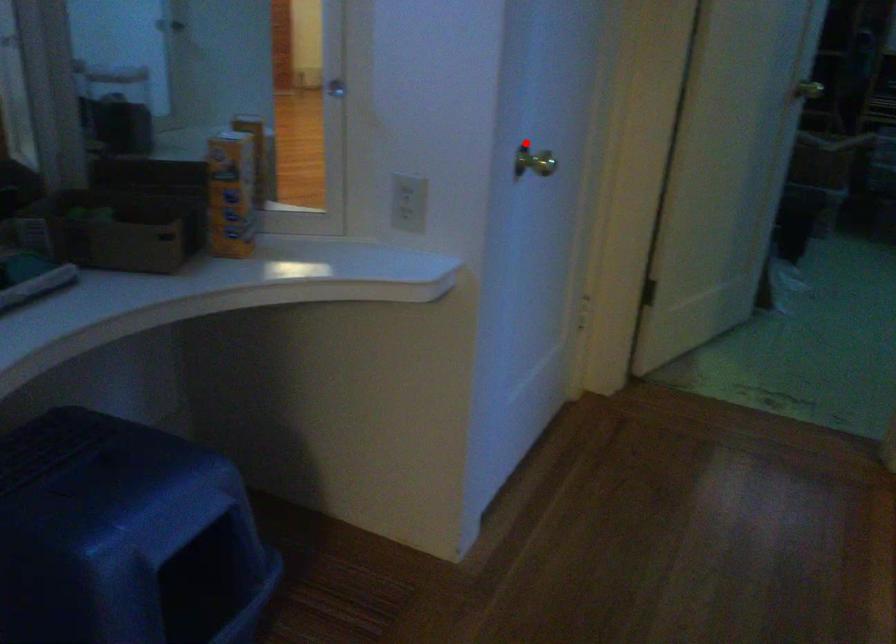
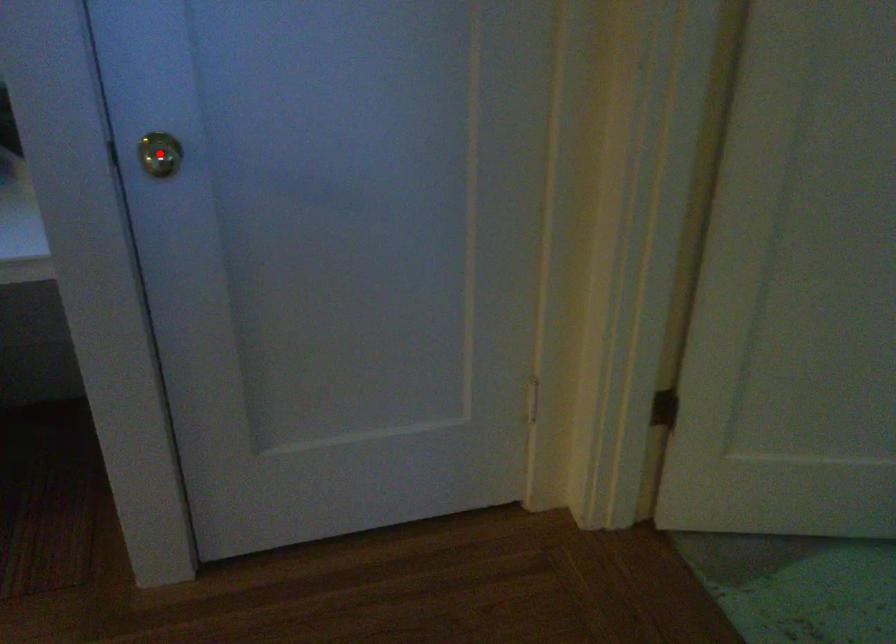
I am providing you with two images of the same scene from different viewpoints. A red point is marked on the first image and another point is marked on the second image. Do the highlighted points in image1 and image2 indicate the same real-world spot?

Yes